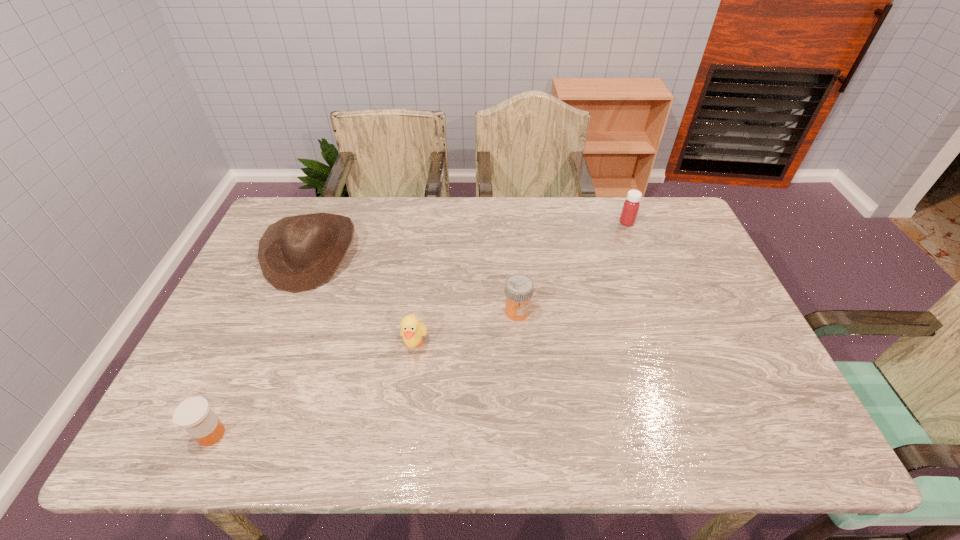
The height and width of the screenshot is (540, 960). I want to click on cowboy hat, so click(x=297, y=253).

I want to click on the rightmost object, so click(x=631, y=206).

Find the location of a particular element. the farthest medicine is located at coordinates (631, 206).

Where is `the second medicine from right to left`? This screenshot has height=540, width=960. the second medicine from right to left is located at coordinates (518, 287).

I want to click on the second farthest medicine, so click(518, 287).

Find the location of `duckling`. duckling is located at coordinates (412, 330).

Where is `the third object from right to left`? the third object from right to left is located at coordinates (412, 330).

Identify the location of the nearest medicine. [x=194, y=414].

Identify the location of the leftmost medicine. (194, 414).

Identify the location of blank space located 0.130m on the right of the cowboy hat. The height and width of the screenshot is (540, 960). (398, 253).